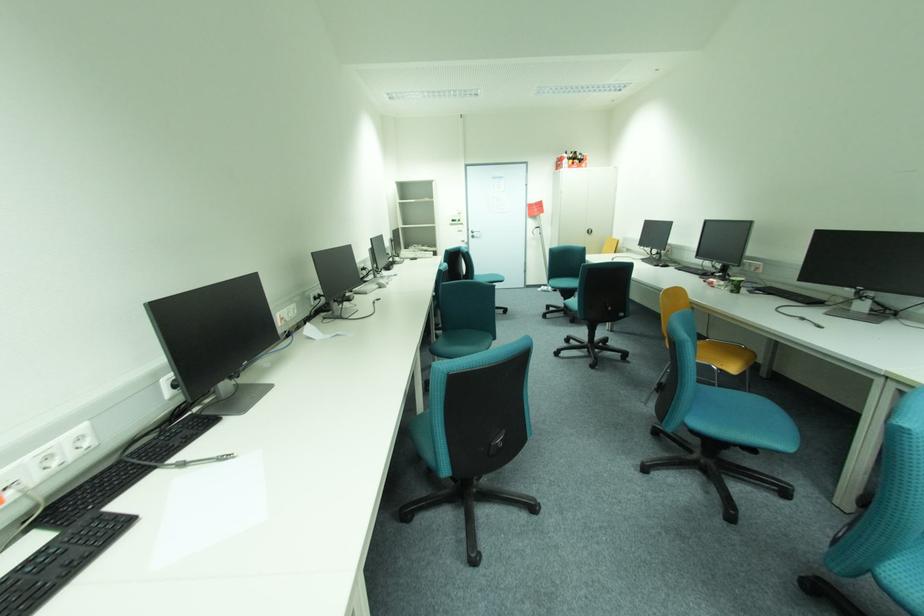
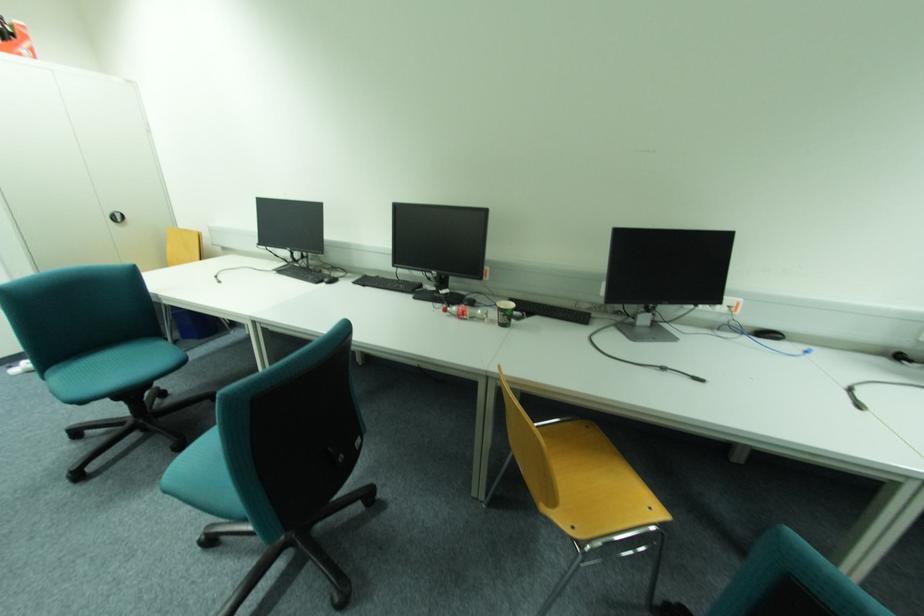
In the second image, find the point that corresponds to pixel 596 232 in the first image.

(126, 219)